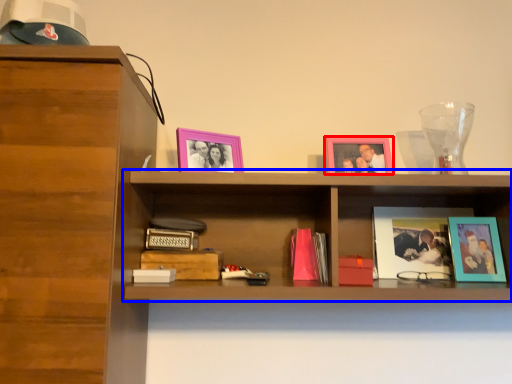
Question: Which of the following is the closest to the observer, picture frame (highlighted by a red box) or shelf (highlighted by a blue box)?

Choices:
 (A) picture frame
 (B) shelf

Answer: (B)